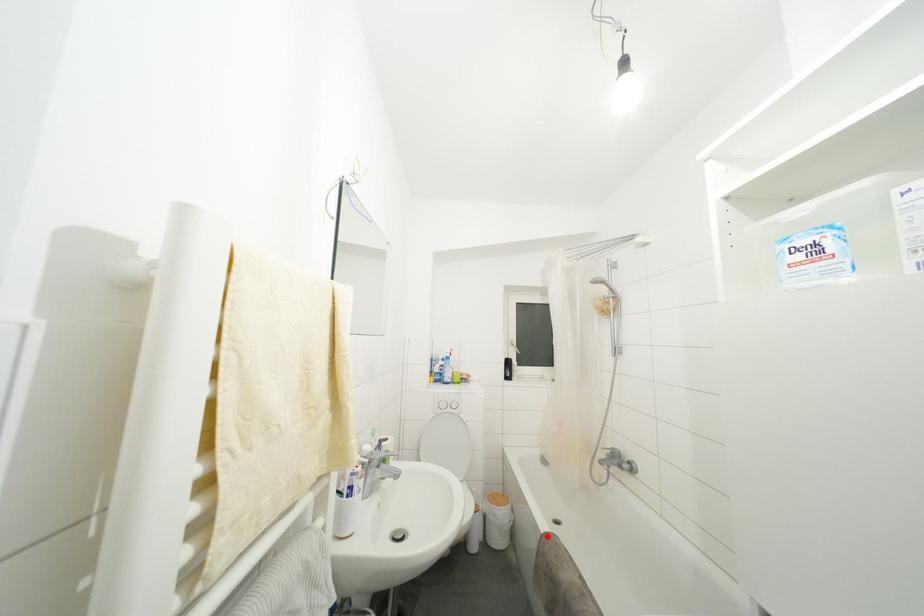
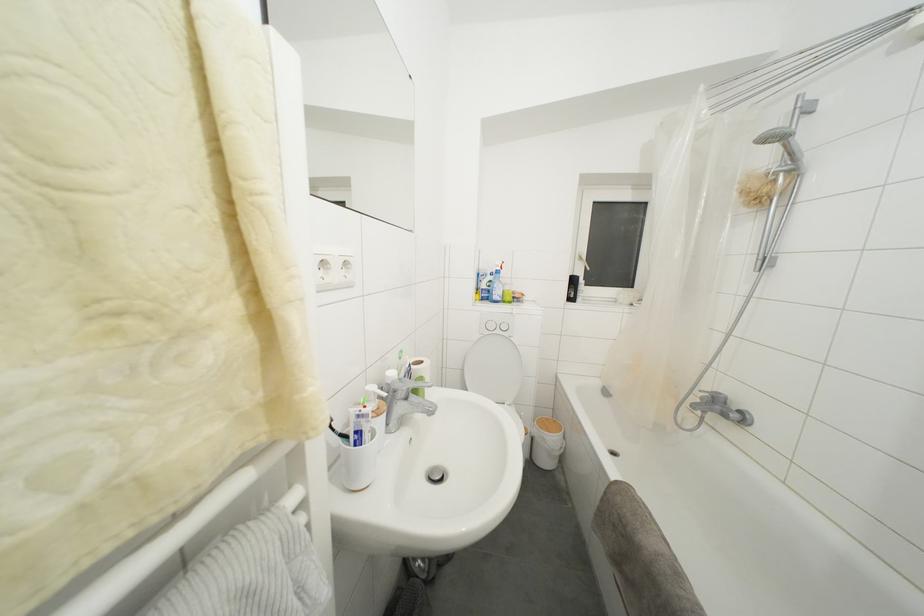
The point at the highlighted location is marked in the first image. Where is the corresponding point in the second image?

(617, 484)